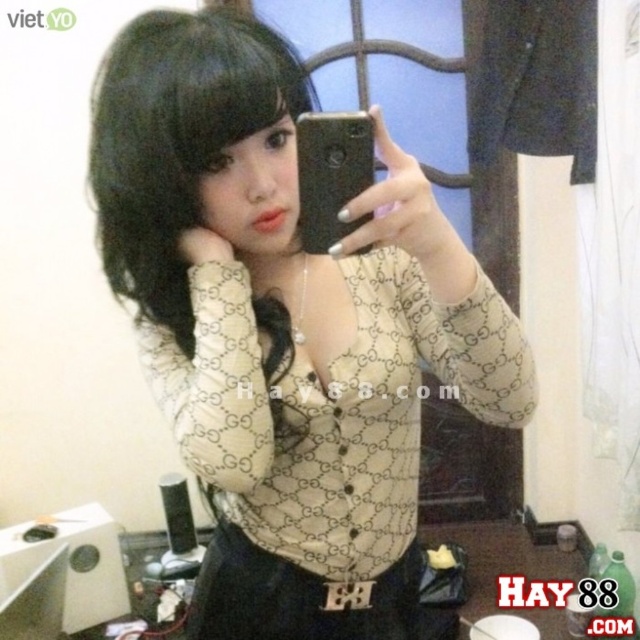
Question: Considering the real-world distances, which object is farthest from the black silky hair at upper left?

Choices:
 (A) black matte smartphone at center
 (B) beige printed shirt at center

Answer: (A)

Question: Is beige printed shirt at center to the left of black matte smartphone at center from the viewer's perspective?

Choices:
 (A) yes
 (B) no

Answer: (A)

Question: Does black silky hair at upper left appear on the right side of black matte smartphone at center?

Choices:
 (A) yes
 (B) no

Answer: (B)

Question: Among these points, which one is farthest from the camera?

Choices:
 (A) (138, 198)
 (B) (349, 221)
 (C) (307, 355)

Answer: (C)

Question: Does black silky hair at upper left have a larger size compared to black matte smartphone at center?

Choices:
 (A) no
 (B) yes

Answer: (B)

Question: Among these objects, which one is farthest from the camera?

Choices:
 (A) beige printed shirt at center
 (B) black silky hair at upper left
 (C) black matte smartphone at center

Answer: (B)